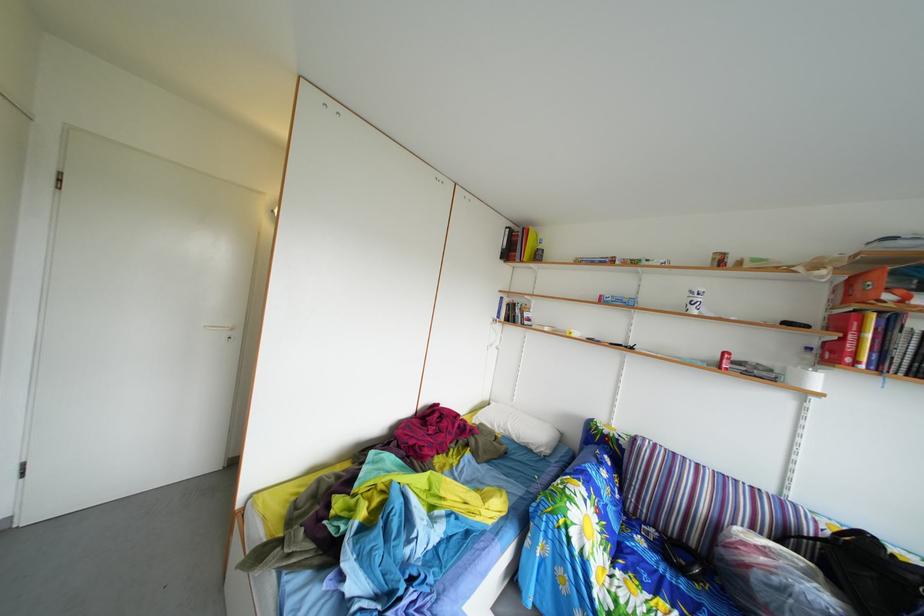
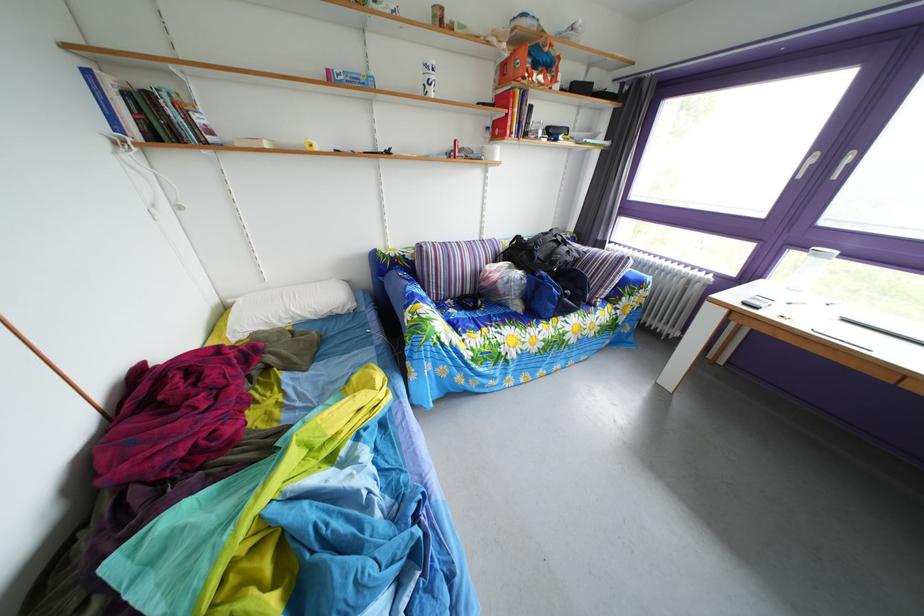
Locate, in the second image, the point that corresponds to point (605, 469) in the first image.

(417, 290)